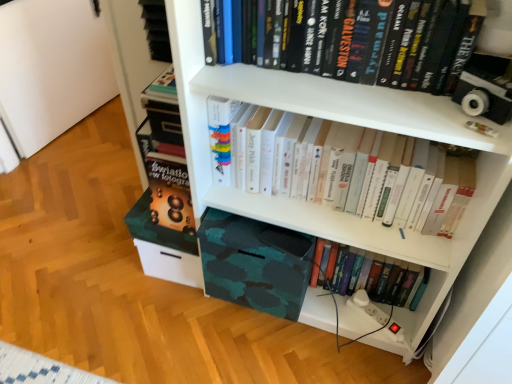
This screenshot has height=384, width=512. I want to click on vacant area on top of camo fabric box at lower center (from a real-world perspective), so click(x=248, y=225).